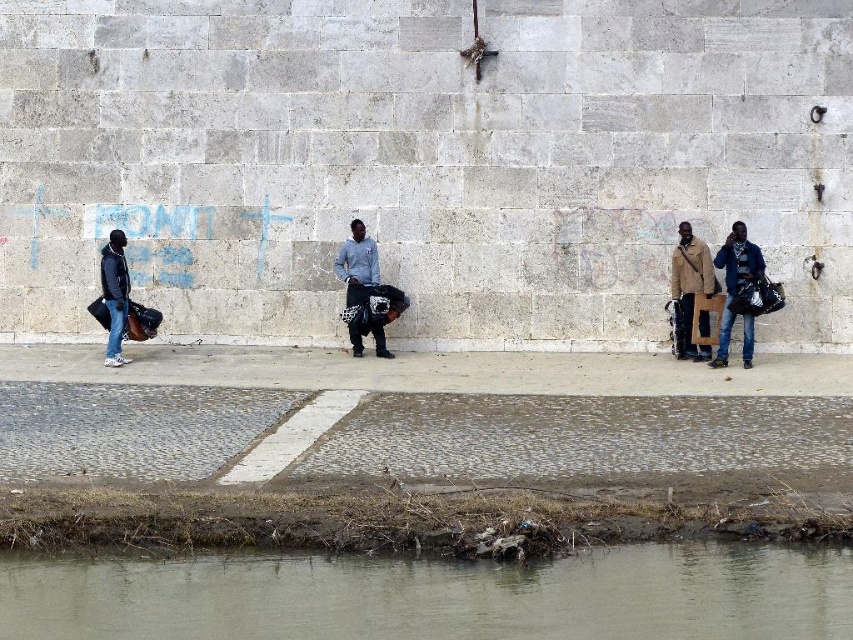
You are standing at the riverbank and see two points marked on the stone wall. Which point is closer to you, point [718,332] or point [117,314]?

Point [718,332] is further to the viewer than point [117,314], so point [117,314] is closer to you.

You are standing at the riverbank and see two points marked on the wall. The first point is at coordinates point (241, 612) and the second is at point (706, 310). Which point is closer to you?

Point (241, 612) is in front of point (706, 310), so the first point is closer to you.

You are a photographer standing at the riverbank. You want to take a photo that includes both the jeans at right and the dark blue jacket at left. Given that your camera has a maximum focus range of 6 meters, will both subjects be in focus?

The distance between the jeans at right and the dark blue jacket at left is 5.97 meters, which is within the camera maximum focus range of 6 meters. Therefore, both subjects will be in focus.